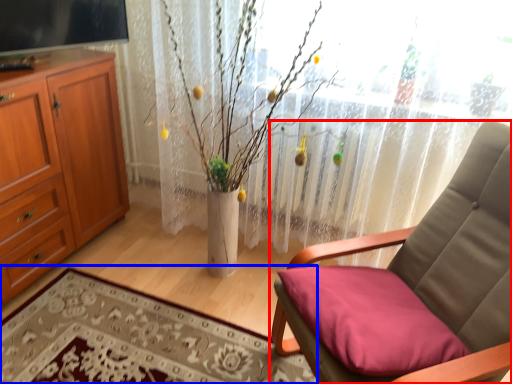
Question: Which object is closer to the camera taking this photo, chair (highlighted by a red box) or plain (highlighted by a blue box)?

Choices:
 (A) chair
 (B) plain

Answer: (A)